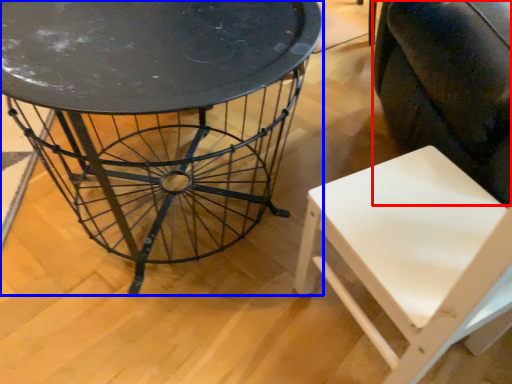
Question: Which object appears closest to the camera in this image, swivel chair (highlighted by a red box) or table (highlighted by a blue box)?

Choices:
 (A) swivel chair
 (B) table

Answer: (A)